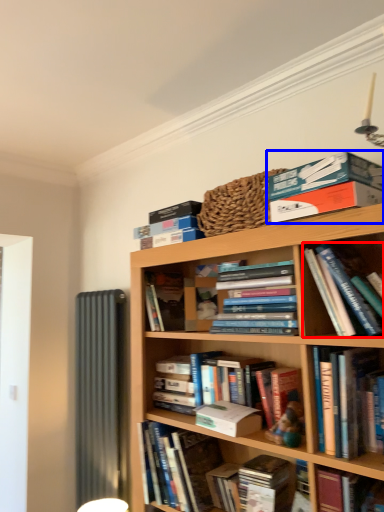
Question: Which object appears farthest to the camera in this image, book (highlighted by a red box) or book (highlighted by a blue box)?

Choices:
 (A) book
 (B) book

Answer: (B)